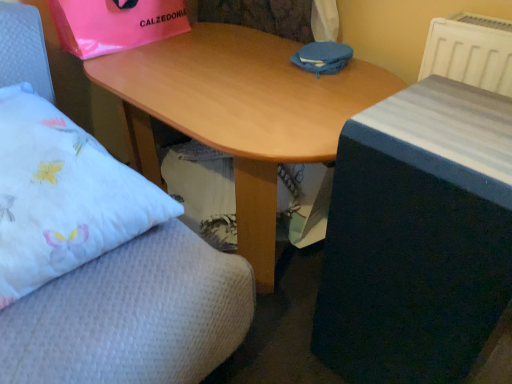
The height and width of the screenshot is (384, 512). I want to click on free spot above wooden table at center (from a real-world perspective), so click(457, 128).